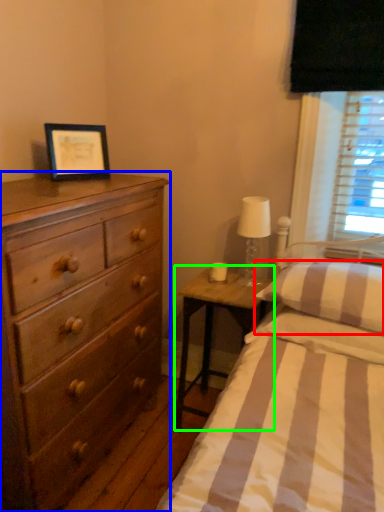
Question: Which object is the closest to the pillow (highlighted by a red box)? Choose among these: chest of drawers (highlighted by a blue box) or nightstand (highlighted by a green box).

Choices:
 (A) chest of drawers
 (B) nightstand

Answer: (B)